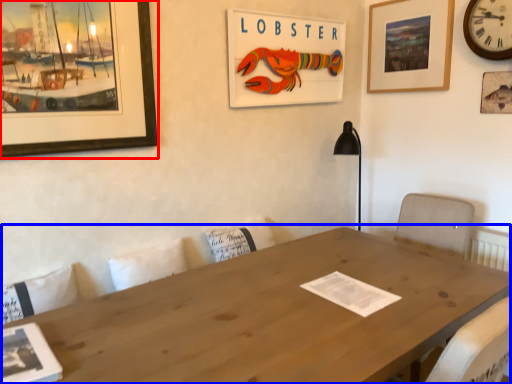
Question: Which point is further to the camera, picture frame (highlighted by a red box) or table (highlighted by a blue box)?

Choices:
 (A) picture frame
 (B) table

Answer: (A)